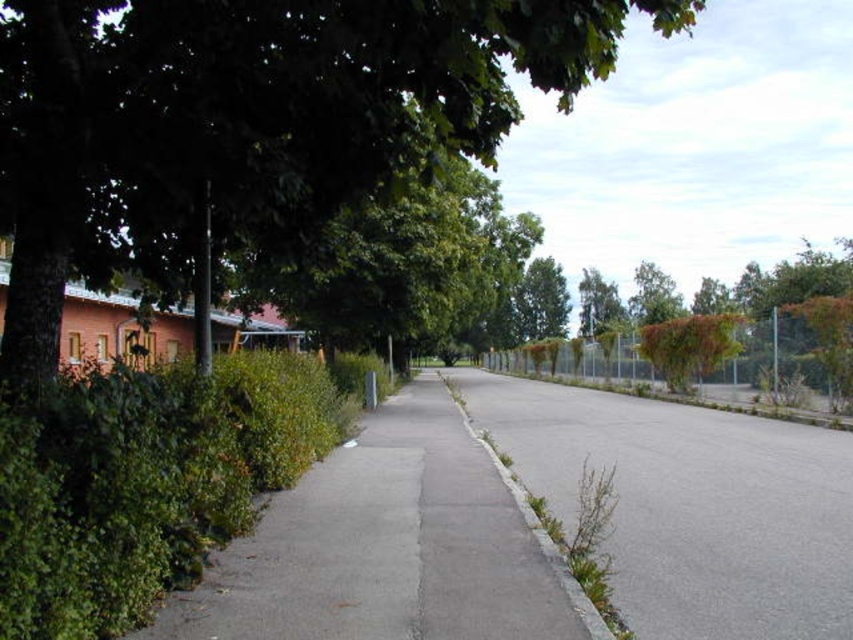
This screenshot has width=853, height=640. In order to click on green leafy tree at center in this screenshot , I will do `click(540, 301)`.

Who is shorter, green leafy tree at center or green leafy tree at upper center?

green leafy tree at upper center

Is point (543, 294) positioned in front of point (616, 326)?

No, it is not.

Locate an element on the screen. The height and width of the screenshot is (640, 853). green leafy tree at center is located at coordinates (540, 301).

Locate an element on the screen. gray asphalt pavement at center is located at coordinates (689, 506).

Is gray asphalt pavement at center to the right of green leafy tree at upper center from the viewer's perspective?

No, gray asphalt pavement at center is not to the right of green leafy tree at upper center.

Between point (827, 508) and point (607, 298), which one is positioned behind?

The point (607, 298) is more distant.

Find the location of a particular element. gray asphalt pavement at center is located at coordinates (689, 506).

Is gray asphalt pavement at center closer to the viewer compared to gray concrete curb at center?

No, it is not.

Who is taller, gray asphalt pavement at center or gray concrete curb at center?

gray concrete curb at center is taller.

Between point (636, 435) and point (590, 604), which one is positioned in front?

Point (590, 604) is in front.

Where is `gray asphalt pavement at center`? The height and width of the screenshot is (640, 853). gray asphalt pavement at center is located at coordinates (689, 506).